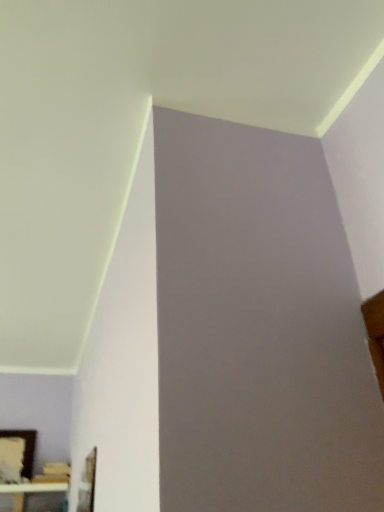
The width and height of the screenshot is (384, 512). What do you see at coordinates (16, 455) in the screenshot?
I see `wooden picture frame at lower left` at bounding box center [16, 455].

Find the location of a particular element. wooden picture frame at lower left is located at coordinates (16, 455).

Image resolution: width=384 pixels, height=512 pixels. In order to click on wooden picture frame at lower left in this screenshot , I will do `click(16, 455)`.